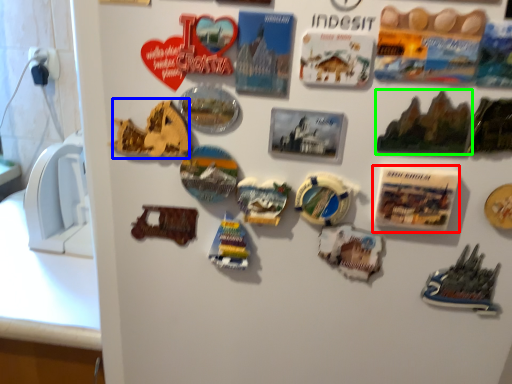
Question: Estimate the real-world distances between objects in this image. Which object is farther from postcard (highlighted by a red box), stuff (highlighted by a blue box) or stuff (highlighted by a green box)?

Choices:
 (A) stuff
 (B) stuff

Answer: (A)